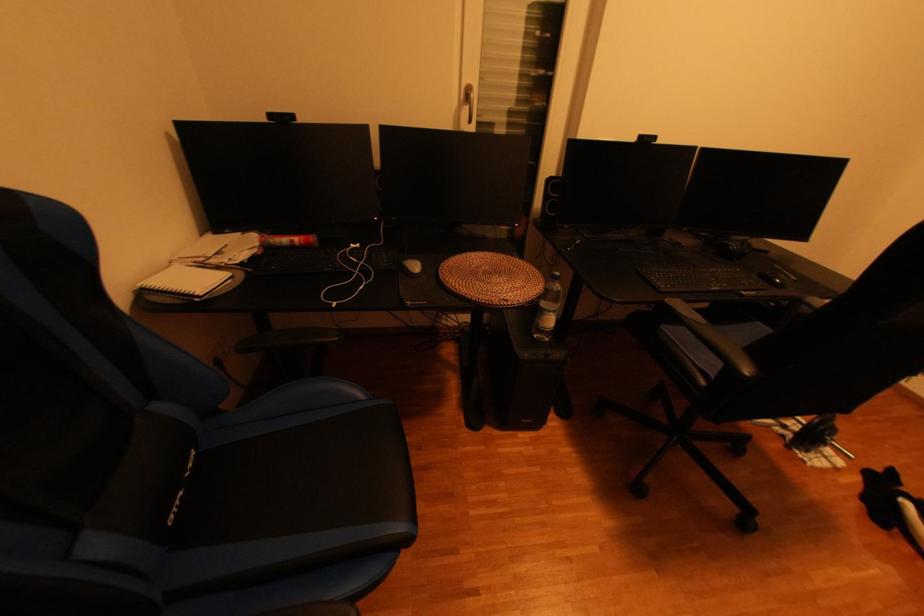
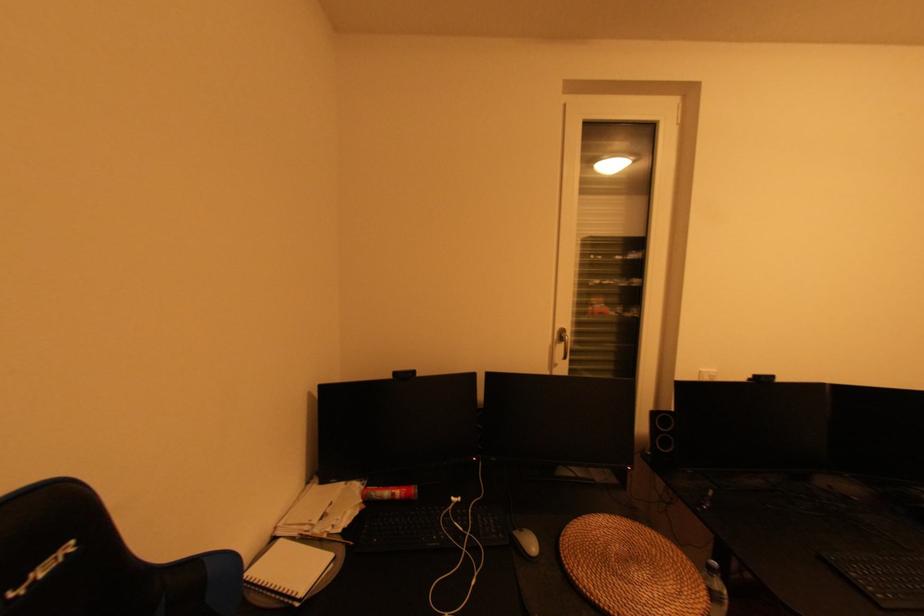
Question: Based on the continuous images, in which direction is the camera rotating? Reply with the corresponding letter.

Choices:
 (A) Left
 (B) Right
 (C) Up
 (D) Down

Answer: (C)